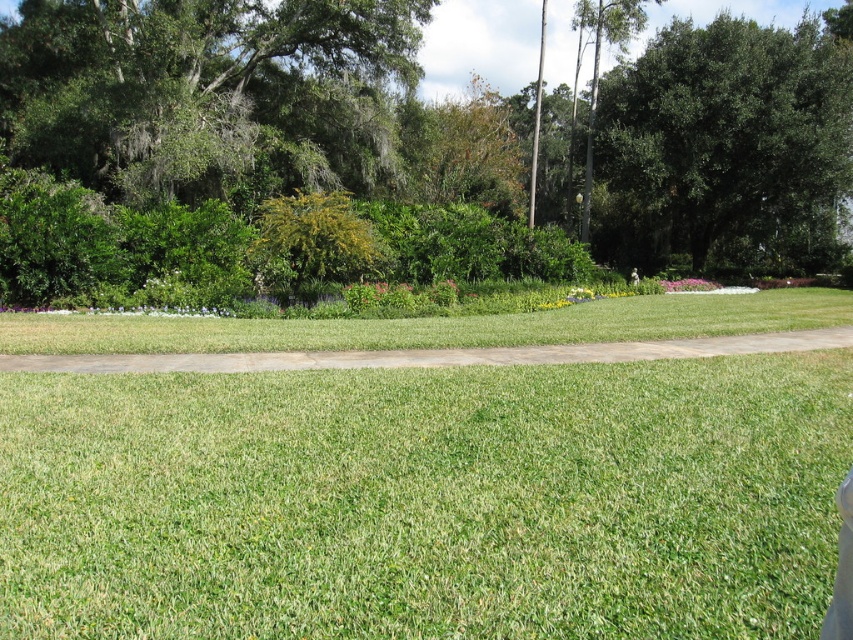
Question: Based on their relative distances, which object is farther from the green leafy tree at upper left?

Choices:
 (A) green leafy tree at upper right
 (B) green leafy tree at upper center

Answer: (A)

Question: Which object is farther from the camera taking this photo?

Choices:
 (A) green leafy tree at upper right
 (B) green leafy tree at upper left
 (C) green leafy tree at upper center

Answer: (A)

Question: Which of these objects is positioned farthest from the green leafy tree at upper right?

Choices:
 (A) green leafy tree at upper center
 (B) green leafy tree at upper left

Answer: (B)

Question: Does green leafy tree at upper left come in front of green leafy tree at upper right?

Choices:
 (A) yes
 (B) no

Answer: (A)

Question: Is green leafy tree at upper center below green leafy tree at upper right?

Choices:
 (A) no
 (B) yes

Answer: (A)

Question: Is the position of green leafy tree at upper center less distant than that of green leafy tree at upper right?

Choices:
 (A) yes
 (B) no

Answer: (A)